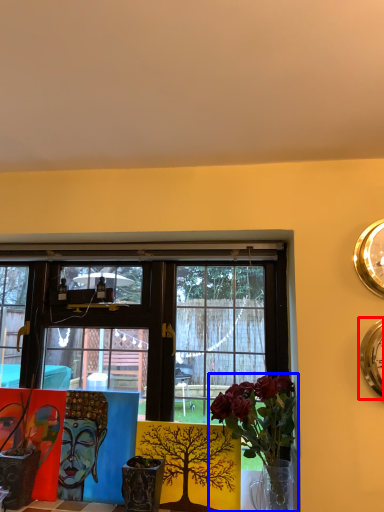
Question: Which object is closer to the camera taking this photo, clock (highlighted by a red box) or houseplant (highlighted by a blue box)?

Choices:
 (A) clock
 (B) houseplant

Answer: (B)